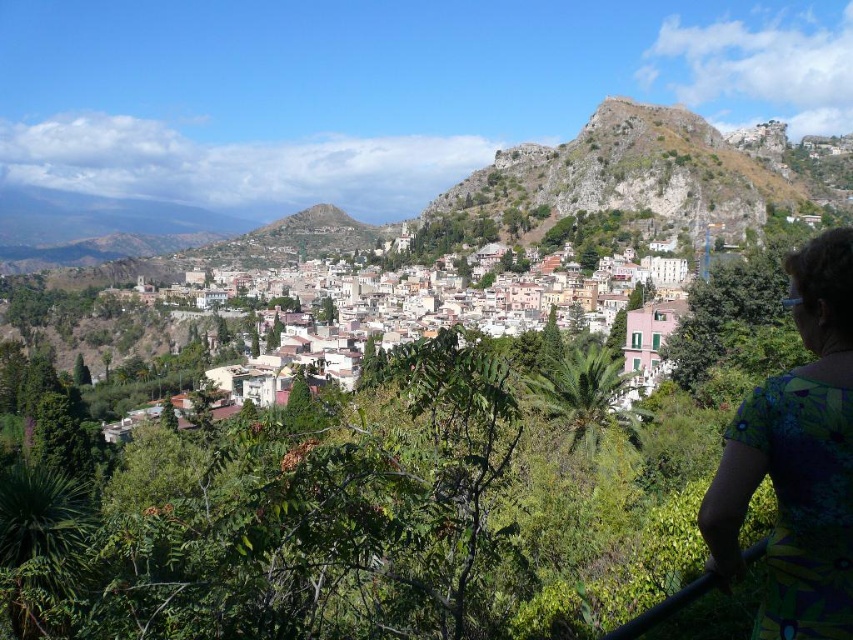
You are a photographer planning to capture a landscape shot of the town. You notice the green floral dress at lower right and the white matte buildings at center in your frame. Considering their heights, which object should you adjust your camera angle to focus on to ensure the buildings remain the main subject?

The green floral dress at lower right has a lesser height compared to the white matte buildings at center. To keep the buildings as the main subject, you should adjust your camera angle to focus on the white matte buildings at center since they are taller and more prominent in the scene.

You are a tourist standing at the edge of the town looking towards the mountain range. You notice the white matte buildings at center and the rugged stone hillside at upper right. Which one appears taller from your vantage point?

The rugged stone hillside at upper right appears taller than the white matte buildings at center from your vantage point.